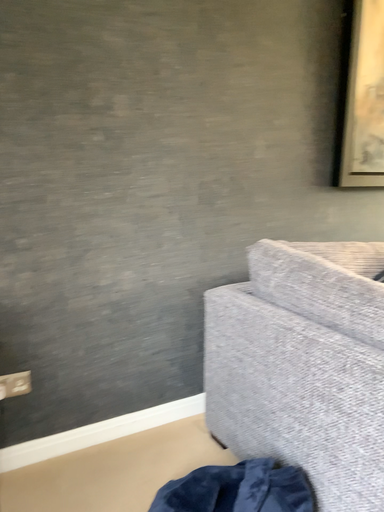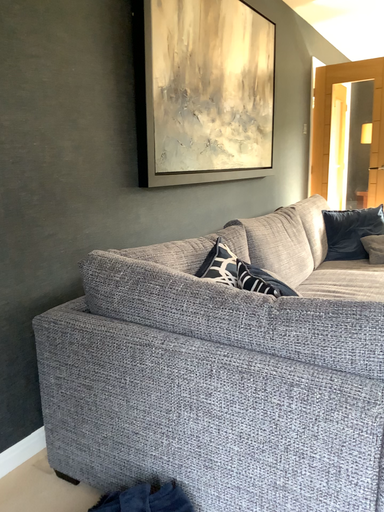
Question: How did the camera likely rotate when shooting the video?

Choices:
 (A) rotated right
 (B) rotated left

Answer: (A)